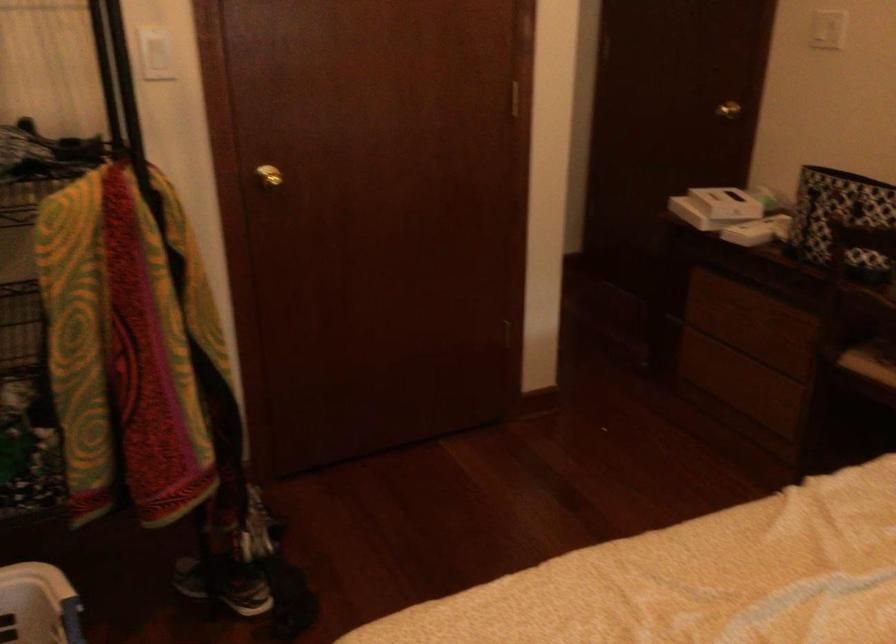
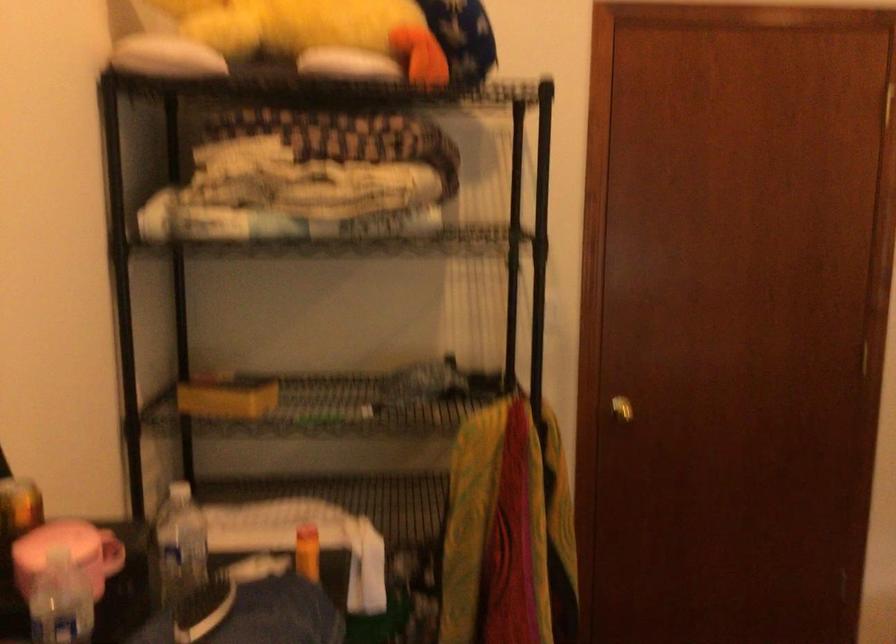
Question: In a continuous first-person perspective shot, in which direction is the camera moving?

Choices:
 (A) Left
 (B) Right
 (C) Forward
 (D) Backward

Answer: (D)